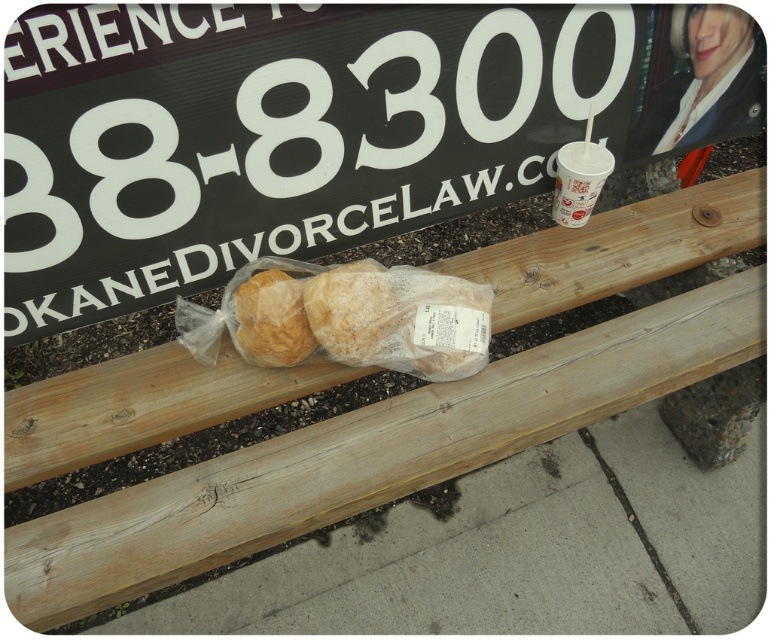
Question: Which point appears closest to the camera in this image?

Choices:
 (A) pos(564,156)
 (B) pos(283,272)
 (C) pos(359,317)

Answer: (C)

Question: Does translucent plastic baguette at center have a smaller size compared to golden brown bread at center?

Choices:
 (A) yes
 (B) no

Answer: (B)

Question: Is translucent plastic baguette at center below white paper cup at upper right?

Choices:
 (A) no
 (B) yes

Answer: (B)

Question: Which point is closer to the camera?

Choices:
 (A) (271, 362)
 (B) (305, 339)
 (C) (564, 161)

Answer: (B)

Question: From the image, what is the correct spatial relationship of golden brown bread at center in relation to white paper cup at upper right?

Choices:
 (A) left
 (B) right

Answer: (A)

Question: Considering the real-world distances, which object is farthest from the translucent plastic baguette at center?

Choices:
 (A) golden brown bread at center
 (B) white paper cup at upper right

Answer: (B)